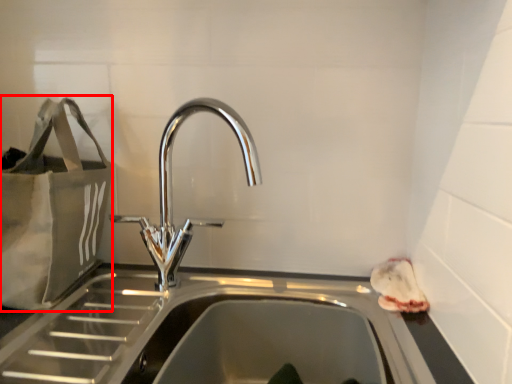
Question: From the image's perspective, where is bag (annotated by the red box) located relative to tap?

Choices:
 (A) below
 (B) above

Answer: (B)